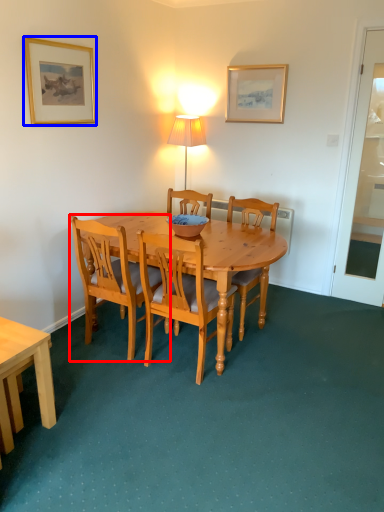
Question: Among these objects, which one is nearest to the camera, chair (highlighted by a red box) or picture frame (highlighted by a blue box)?

Choices:
 (A) chair
 (B) picture frame

Answer: (A)